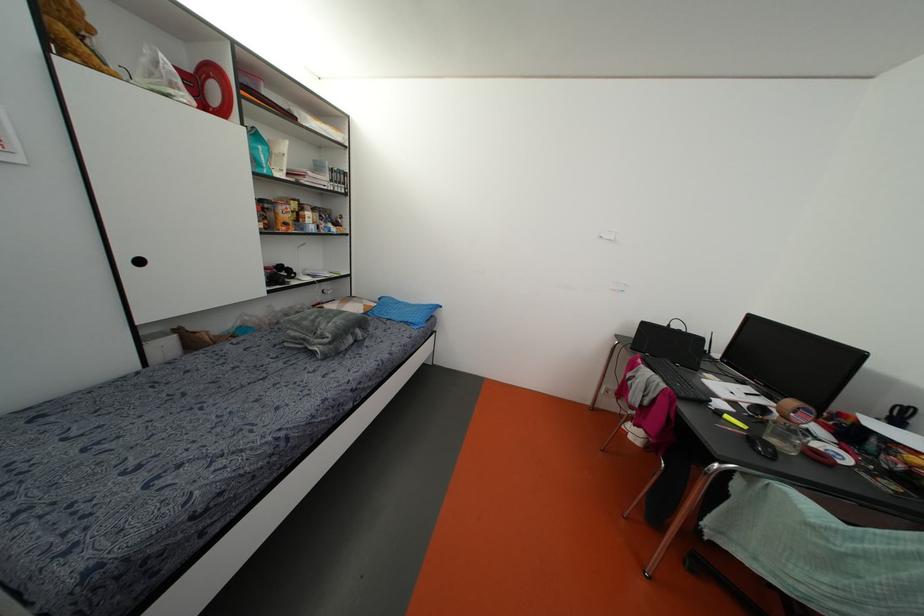
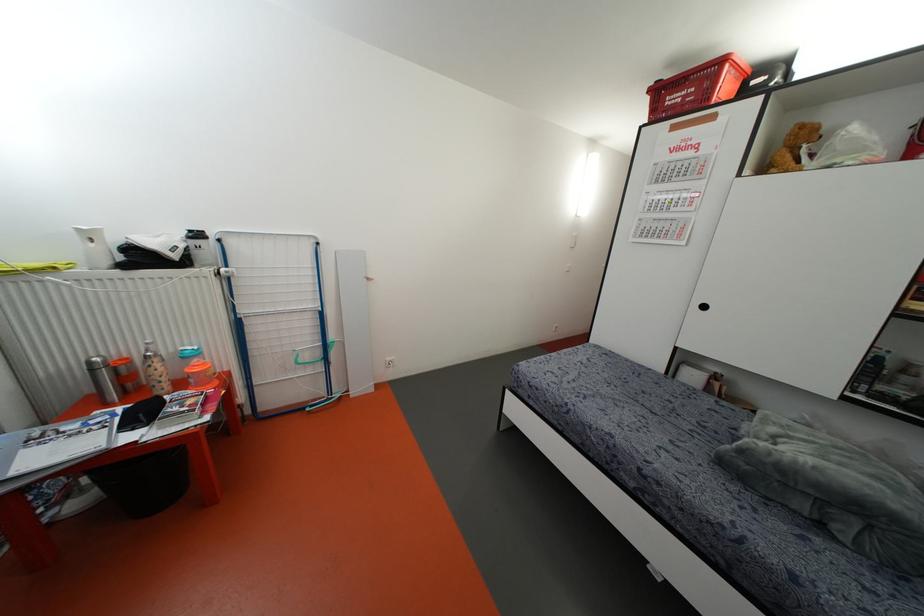
The point at (79, 37) is marked in the first image. Where is the corresponding point in the second image?

(796, 150)